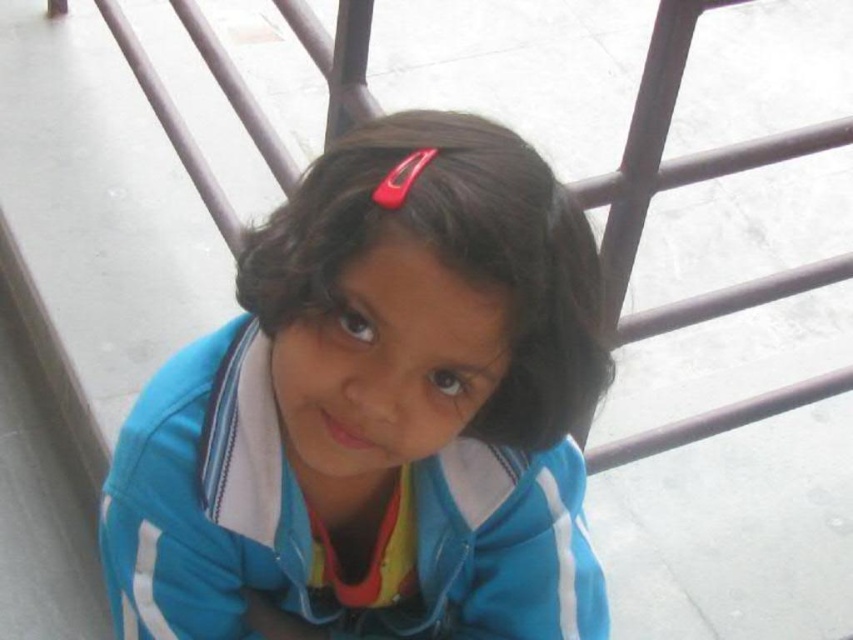
You are a photographer trying to capture a candid shot of the girl leaning against the metal railing. You want to ensure the subject is in focus. If your camera has a depth of field that can sharply focus objects within 30 inches, will the point at coordinates point (351, 253) be within the focus range?

The point (351, 253) is 29.04 inches from the camera, which is within the 30 inches depth of field range. Therefore, the point will be in focus.

You are a photographer trying to capture the girl in the image. The blue fabric jacket at center is represented by point (376, 412). Where should you position your camera to ensure the girl is centered in the frame?

To center the girl in the frame, position the camera so that the point (376, 412) representing the blue fabric jacket at center is aligned with the frame center.

The blue fabric jacket at center is part of a girl wearing it. The girl is leaning against a metal railing with horizontal bars. If the distance between the girl and the railing is 27.42 inches, can the girl reach the railing with her outstretched hand?

The distance between the girl and the railing is 27.42 inches. An average person can reach about 24 to 30 inches with an outstretched hand, so it is possible that the girl can reach the railing with her outstretched hand.